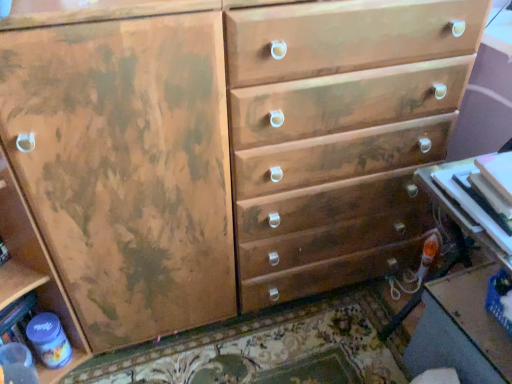
Identify the location of free location above matte plastic table at lower right, marked as the first table in a bottom-to-top arrangement (from a real-world perspective). The height and width of the screenshot is (384, 512). (482, 309).